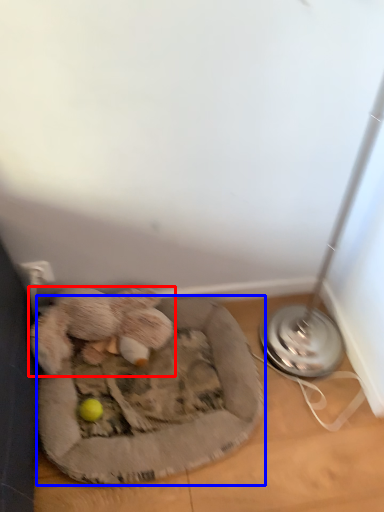
Question: Which point is further to the camera, toy (highlighted by a red box) or dog bed (highlighted by a blue box)?

Choices:
 (A) toy
 (B) dog bed

Answer: (A)